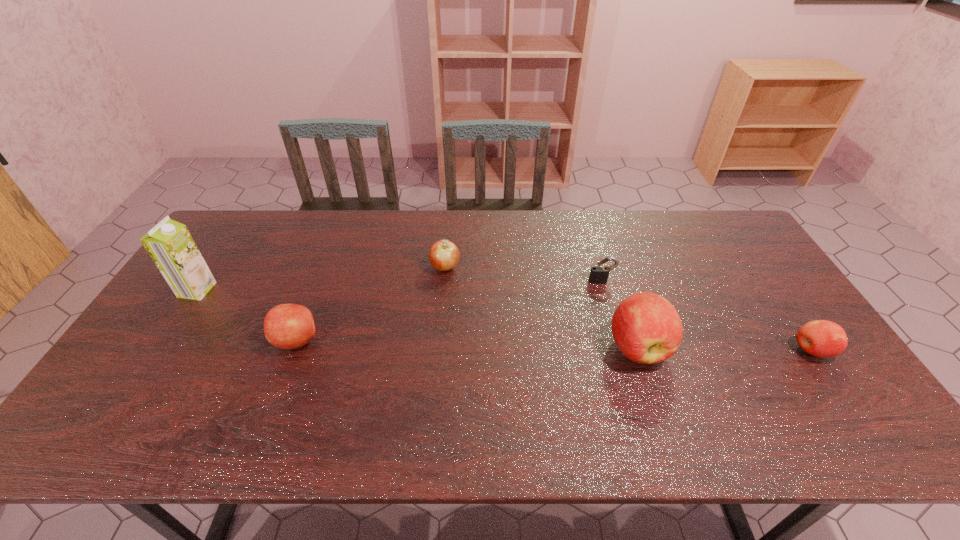
Identify the location of unoccupied position between the tallest apple and the rightmost apple. This screenshot has height=540, width=960. (725, 349).

This screenshot has height=540, width=960. Identify the location of empty space that is in between the tallest apple and the soya milk. (418, 319).

Locate which object ranks third in proximity to the padlock. Please provide its 2D coordinates. Your answer should be formatted as a tuple, i.e. [(x, y)], where the tuple contains the x and y coordinates of a point satisfying the conditions above.

[(821, 338)]

Locate an element on the screen. The width and height of the screenshot is (960, 540). the fourth closest object to the padlock is located at coordinates tap(288, 326).

Locate an element on the screen. This screenshot has height=540, width=960. the third closest apple relative to the tallest apple is located at coordinates (288, 326).

Image resolution: width=960 pixels, height=540 pixels. What are the coordinates of `apple that stands as the second closest to the farthest object` in the screenshot? It's located at (647, 329).

You are a GUI agent. You are given a task and a screenshot of the screen. Output one action in this format:
    pyautogui.click(x=<x>, y=<y>)
    Task: Click on the vacant space that satisfies the following two spatial constraints: 1. on the front side of the rightmost object; 2. on the left side of the soya milk
    
    Given the screenshot: What is the action you would take?
    pyautogui.click(x=156, y=350)

In order to click on free region that satisfies the following two spatial constraints: 1. with the keyhole on the front of the second apple from right to left; 2. on the left side of the padlock in this screenshot , I will do `click(620, 347)`.

Where is `free location that satisfies the following two spatial constraints: 1. on the front side of the tallest apple; 2. on the right side of the leftmost object`? free location that satisfies the following two spatial constraints: 1. on the front side of the tallest apple; 2. on the right side of the leftmost object is located at coordinates pos(159,347).

I want to click on free point that satisfies the following two spatial constraints: 1. on the back side of the leftmost apple; 2. on the left side of the fourth object from right to left, so click(325, 267).